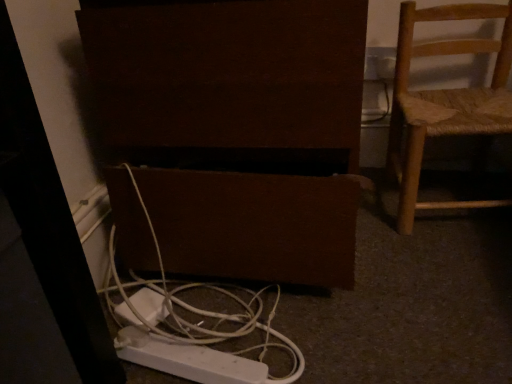
Question: Can you confirm if woven wood chair at right is taller than white plastic cable at lower center?

Choices:
 (A) no
 (B) yes

Answer: (B)

Question: Does woven wood chair at right have a lesser height compared to white plastic cable at lower center?

Choices:
 (A) no
 (B) yes

Answer: (A)

Question: Is woven wood chair at right facing towards white plastic cable at lower center?

Choices:
 (A) yes
 (B) no

Answer: (B)

Question: Is woven wood chair at right smaller than white plastic cable at lower center?

Choices:
 (A) yes
 (B) no

Answer: (B)

Question: From the image's perspective, is woven wood chair at right located beneath white plastic cable at lower center?

Choices:
 (A) yes
 (B) no

Answer: (B)

Question: Is woven wood chair at right beside white plastic cable at lower center?

Choices:
 (A) yes
 (B) no

Answer: (B)

Question: Is white plastic cable at lower center at the left side of white plastic outlet at upper right?

Choices:
 (A) no
 (B) yes

Answer: (B)

Question: Is white plastic cable at lower center outside white plastic outlet at upper right?

Choices:
 (A) no
 (B) yes

Answer: (B)

Question: Can you confirm if white plastic cable at lower center is thinner than white plastic outlet at upper right?

Choices:
 (A) yes
 (B) no

Answer: (B)

Question: Could you tell me if white plastic cable at lower center is facing white plastic outlet at upper right?

Choices:
 (A) yes
 (B) no

Answer: (B)

Question: Can you confirm if white plastic cable at lower center is taller than white plastic outlet at upper right?

Choices:
 (A) yes
 (B) no

Answer: (A)

Question: Can you see white plastic cable at lower center touching white plastic outlet at upper right?

Choices:
 (A) no
 (B) yes

Answer: (A)

Question: Is white plastic cable at lower center positioned in front of woven wood chair at right?

Choices:
 (A) yes
 (B) no

Answer: (A)